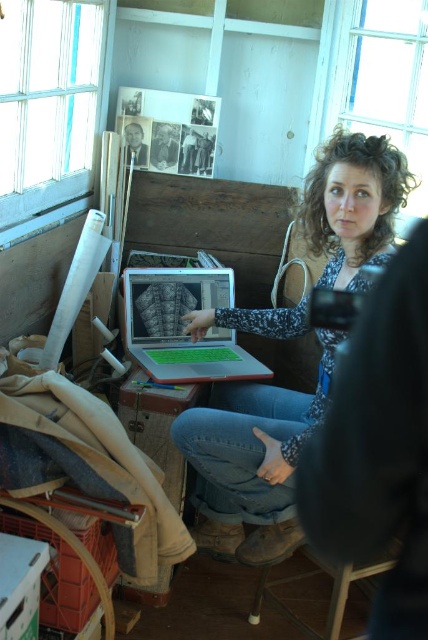
You are setting up a video call and need to ensure both the silver metallic laptop at center and the matte black laptop at center are visible. Which laptop is closer to the camera?

The silver metallic laptop at center is closer to the camera because it is in front of the matte black laptop at center.

You are setting up a video call and need to place both the silver metallic laptop at center and the matte black laptop at center so that the silver one is to the right of the matte one. Based on the scene description, is this arrangement already correct?

Yes, the silver metallic laptop at center is already positioned on the right side of the matte black laptop at center, so the arrangement is correct.